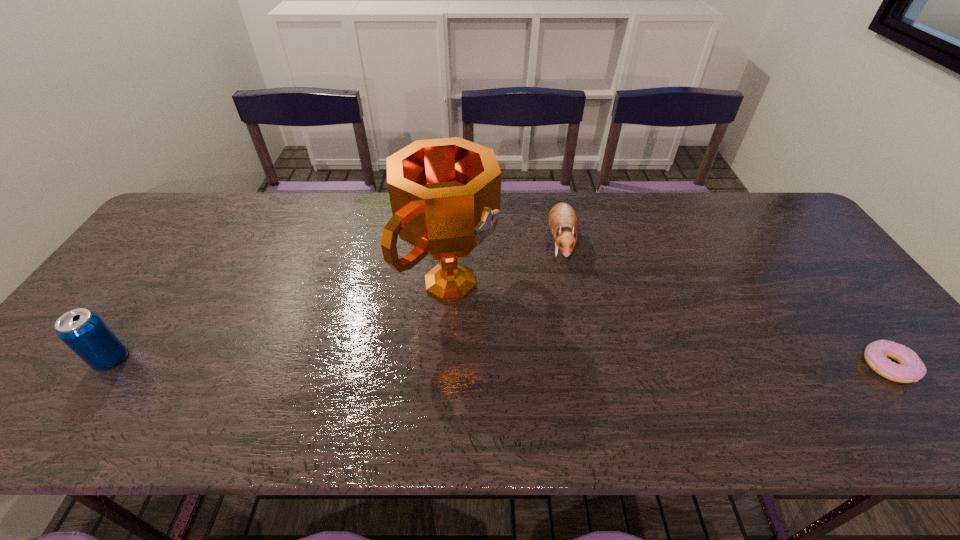
Image resolution: width=960 pixels, height=540 pixels. Identify the location of object present at the right edge. (910, 369).

Identify the location of object that is positioned at the near left corner. This screenshot has width=960, height=540. (84, 332).

Find the location of a particular element. This screenshot has width=960, height=540. object positioned at the near right corner is located at coordinates (910, 369).

In the image, there is a desktop. In order to click on free region at the far edge in this screenshot , I will do `click(377, 210)`.

The image size is (960, 540). I want to click on vacant space at the near edge, so click(x=241, y=386).

Locate an element on the screen. The height and width of the screenshot is (540, 960). vacant space at the left edge of the desktop is located at coordinates (128, 319).

You are a GUI agent. You are given a task and a screenshot of the screen. Output one action in this format:
    pyautogui.click(x=<x>, y=<y>)
    Task: Click on the vacant space at the right edge of the desktop
    
    Given the screenshot: What is the action you would take?
    834,332

The width and height of the screenshot is (960, 540). What are the coordinates of `vacant space at the far right corner of the desktop` in the screenshot? It's located at (778, 204).

In order to click on free space between the second object from right to left and the leftmost object in this screenshot , I will do `click(336, 301)`.

Locate an element on the screen. This screenshot has height=540, width=960. vacant point located between the award and the second object from right to left is located at coordinates (506, 262).